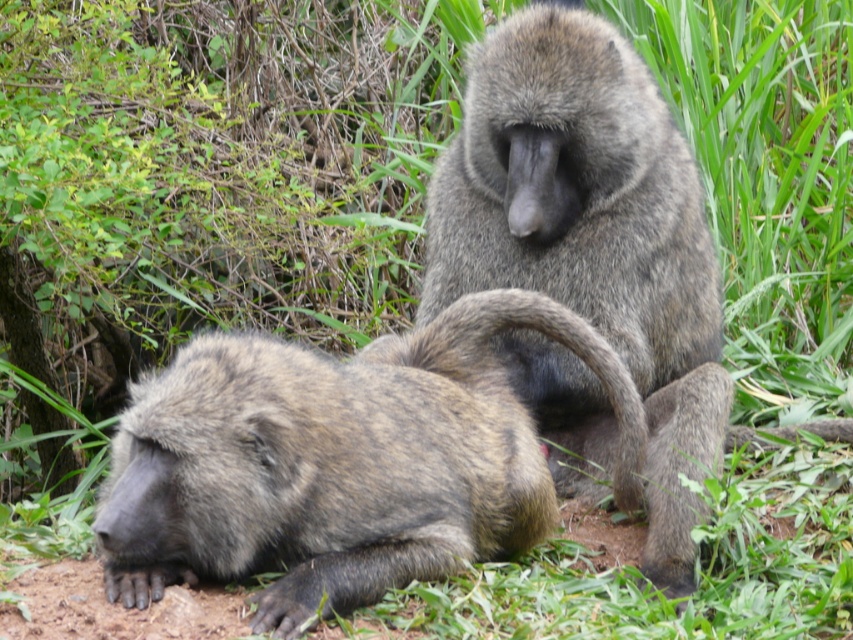
Question: Can you confirm if brown fur monkey at lower left is smaller than gray furry monkey at center?

Choices:
 (A) no
 (B) yes

Answer: (A)

Question: Can you confirm if brown fur monkey at lower left is thinner than gray furry monkey at center?

Choices:
 (A) yes
 (B) no

Answer: (B)

Question: Which object appears farthest from the camera in this image?

Choices:
 (A) gray furry monkey at center
 (B) brown fur monkey at lower left

Answer: (A)

Question: Can you confirm if brown fur monkey at lower left is positioned below gray furry monkey at center?

Choices:
 (A) no
 (B) yes

Answer: (B)